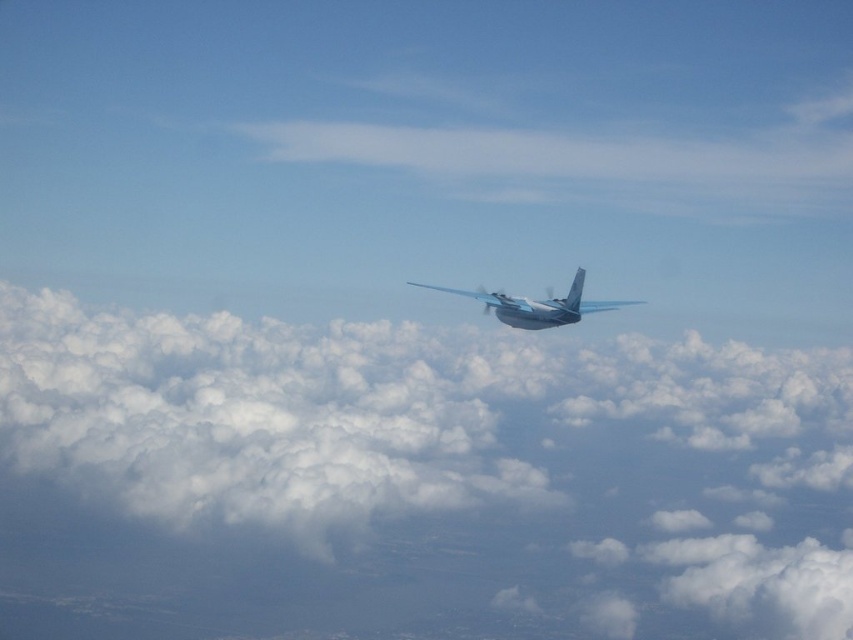
You are a pilot flying the metallic silver airplane at center. You notice a white fluffy cloud at center in your path. Can you safely fly over the cloud without hitting it?

The white fluffy cloud at center has a greater height compared to the metallic silver airplane at center, so you cannot safely fly over the cloud without hitting it.